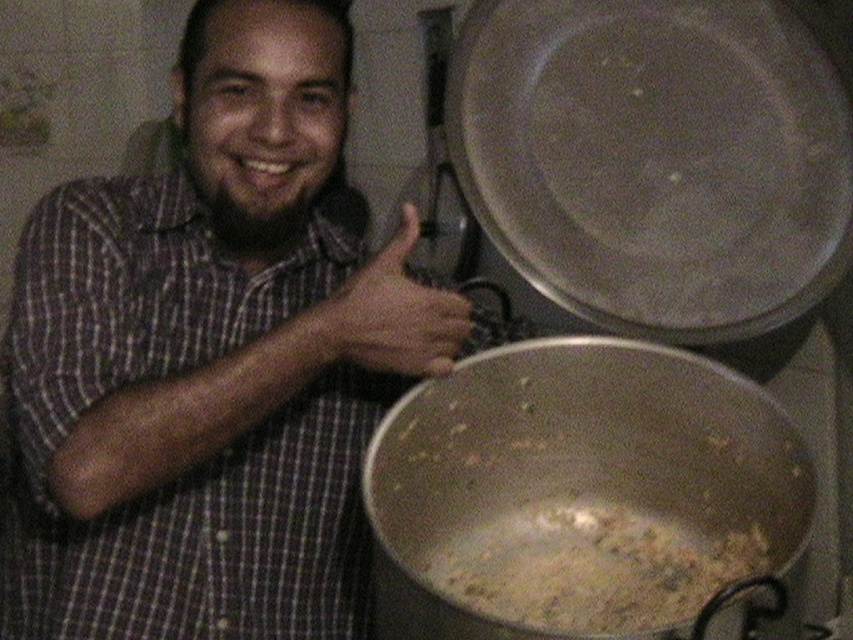
Is brown crumbly food at center taller than brown leather hand at center?

Incorrect, brown crumbly food at center's height is not larger of brown leather hand at center's.

Which is above, brown crumbly food at center or brown leather hand at center?

brown leather hand at center

Is point (648, 572) positioned before point (387, 307)?

That is False.

This screenshot has height=640, width=853. Find the location of `brown crumbly food at center`. brown crumbly food at center is located at coordinates (593, 568).

Is point (407, 524) positioned in front of point (428, 332)?

No, it is not.

How much distance is there between metallic silver pot at lower center and brown leather hand at center?

metallic silver pot at lower center and brown leather hand at center are 7.34 inches apart from each other.

What are the coordinates of `metallic silver pot at lower center` in the screenshot? It's located at (582, 472).

Where is `metallic silver pot at lower center`? This screenshot has height=640, width=853. metallic silver pot at lower center is located at coordinates (582, 472).

Is metallic silver pot at lower center wider than brown crumbly food at center?

Result: Indeed, metallic silver pot at lower center has a greater width compared to brown crumbly food at center.

I want to click on metallic silver pot at lower center, so point(582,472).

Which is behind, point (390, 524) or point (714, 576)?

Point (714, 576)

In order to click on metallic silver pot at lower center in this screenshot , I will do [582, 472].